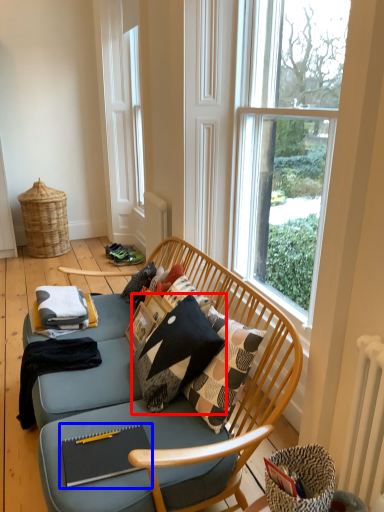
Question: Which object is further to the camera taking this photo, throw pillow (highlighted by a red box) or magazine (highlighted by a blue box)?

Choices:
 (A) throw pillow
 (B) magazine

Answer: (A)